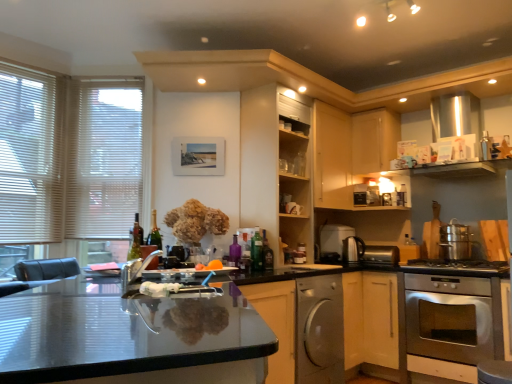
At what (x,y) coordinates should I click in order to perform the action: click on vacant area on top of white blinds at left (from a real-world perspective). Please return your answer as a coordinate pair (x, y). This screenshot has width=512, height=384. Looking at the image, I should click on (31, 57).